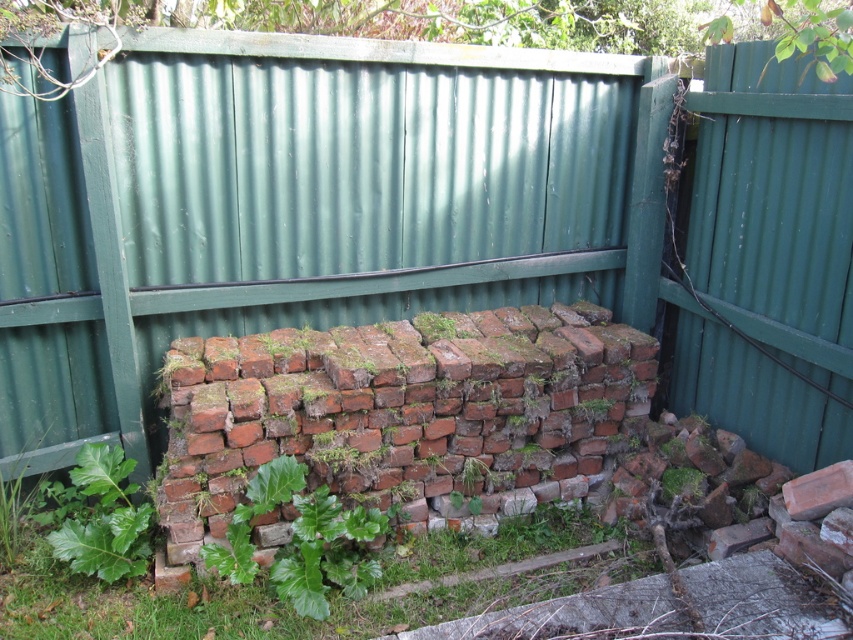
Question: Is green leafy grass at lower center smaller than green leafy plant at center?

Choices:
 (A) yes
 (B) no

Answer: (B)

Question: Which of the following is the farthest from the observer?

Choices:
 (A) green leafy plant at lower left
 (B) green leafy plant at center
 (C) green leafy grass at lower center
 (D) reddish-brown bricks at center

Answer: (D)

Question: Which point is farther to the camera?

Choices:
 (A) green leafy plant at center
 (B) green leafy grass at lower center
 (C) reddish-brown bricks at center

Answer: (C)

Question: Where is reddish-brown bricks at center located in relation to green leafy grass at lower center in the image?

Choices:
 (A) below
 (B) above

Answer: (B)

Question: Is reddish-brown bricks at center thinner than green leafy plant at lower left?

Choices:
 (A) yes
 (B) no

Answer: (B)

Question: Among these objects, which one is farthest from the camera?

Choices:
 (A) green leafy plant at lower left
 (B) green leafy grass at lower center

Answer: (A)